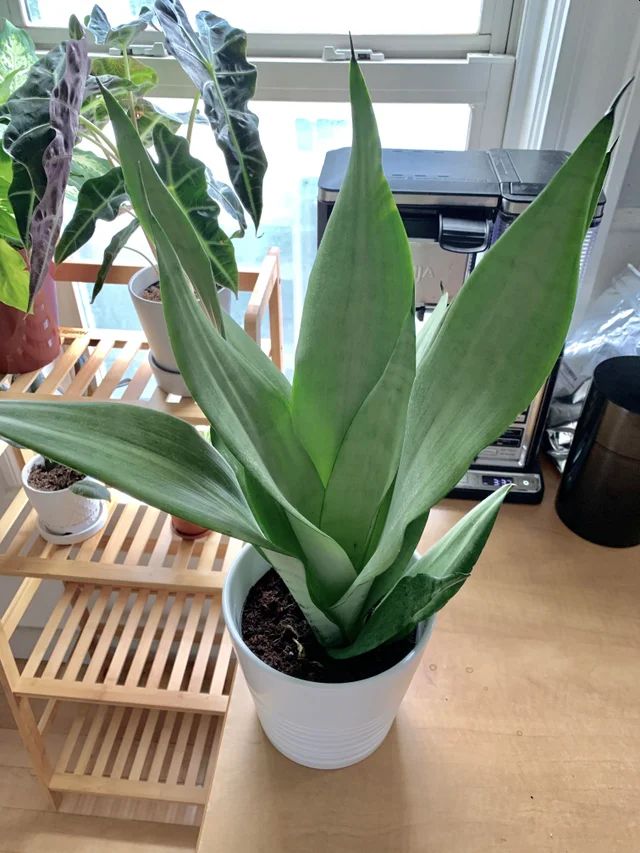
Image resolution: width=640 pixels, height=853 pixels. Identify the location of brown plant pot. (24, 351).